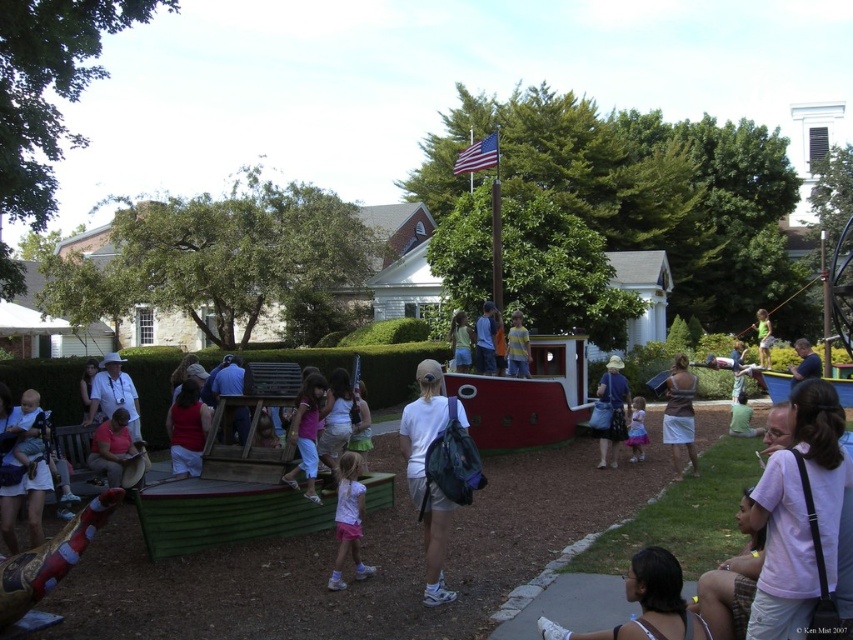
You are standing at the center of the park and want to walk to both the point at coordinates (814, 428) and the point at (351, 461). Which point will you reach first?

You will reach the point at coordinates (814, 428) first because it is closer to you than the point at (351, 461).

You are a photographer at the community event. You want to capture a photo that includes both the pink cotton shirt at lower right and the white matte dress at center. Based on their positions, which one should you focus on first to ensure both are in the frame?

The pink cotton shirt at lower right is located above the white matte dress at center, so you should focus on the white matte dress at center first to ensure both are in the frame.